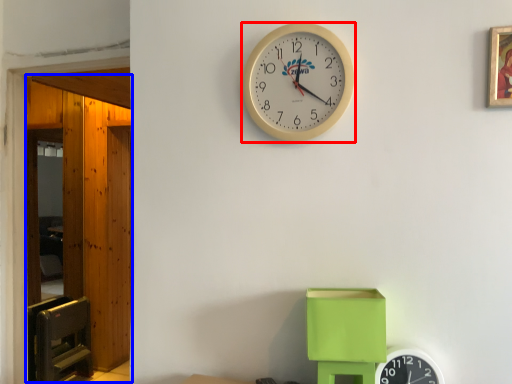
Question: Which object is closer to the camera taking this photo, wall clock (highlighted by a red box) or glass door (highlighted by a blue box)?

Choices:
 (A) wall clock
 (B) glass door

Answer: (A)